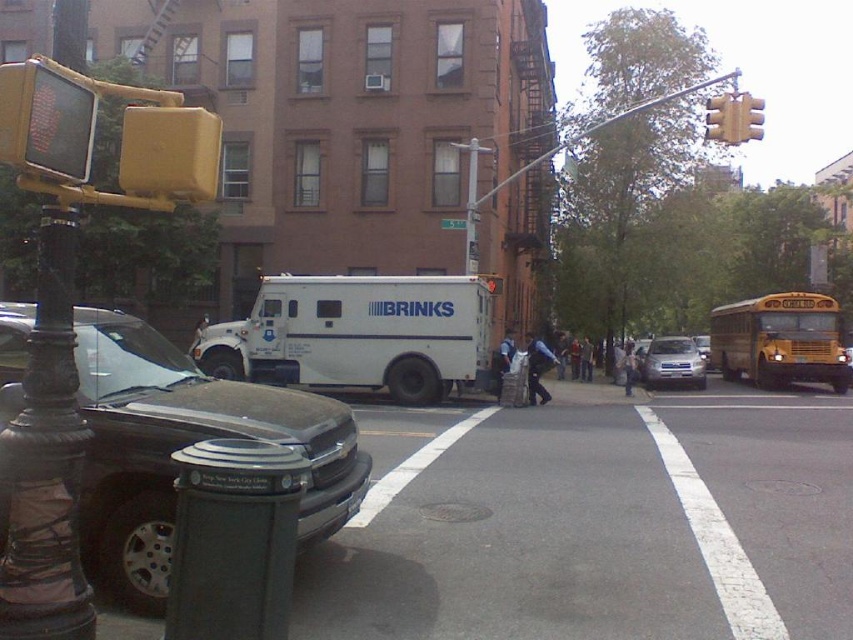
The height and width of the screenshot is (640, 853). What do you see at coordinates (184, 445) in the screenshot?
I see `metallic gray suv at center-left` at bounding box center [184, 445].

Is metallic gray suv at center-left thinner than white matte armored vehicle at center?

Yes.

Which is in front, point (148, 532) or point (370, 378)?

Point (148, 532) is in front.

Find the location of `metallic gray suv at center-left`. metallic gray suv at center-left is located at coordinates (184, 445).

Is point (91, 452) positioned behind point (749, 300)?

No.

The width and height of the screenshot is (853, 640). Describe the element at coordinates (184, 445) in the screenshot. I see `metallic gray suv at center-left` at that location.

The height and width of the screenshot is (640, 853). I want to click on metallic gray suv at center-left, so tap(184, 445).

Which is in front, point (370, 307) or point (722, 118)?

Point (722, 118)

Is point (341, 289) closer to viewer compared to point (722, 122)?

No, it is not.

The height and width of the screenshot is (640, 853). Identify the location of white matte armored vehicle at center. (358, 333).

Where is `white matte armored vehicle at center`? white matte armored vehicle at center is located at coordinates (358, 333).